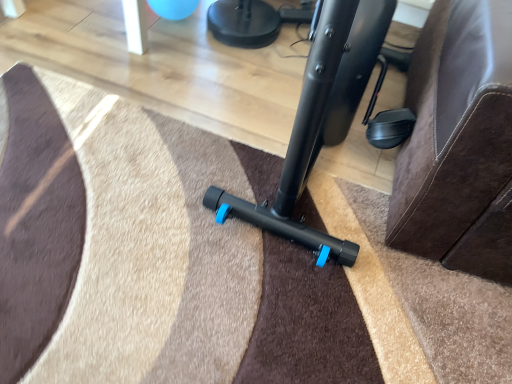
This screenshot has height=384, width=512. What do you see at coordinates (198, 273) in the screenshot?
I see `brown textured doormat at center` at bounding box center [198, 273].

This screenshot has height=384, width=512. I want to click on brown textured doormat at center, so click(198, 273).

Measure the distance between brown textured doormat at center and camera.

brown textured doormat at center and camera are 31.29 inches apart from each other.

Where is `brown textured doormat at center`? Image resolution: width=512 pixels, height=384 pixels. brown textured doormat at center is located at coordinates (198, 273).